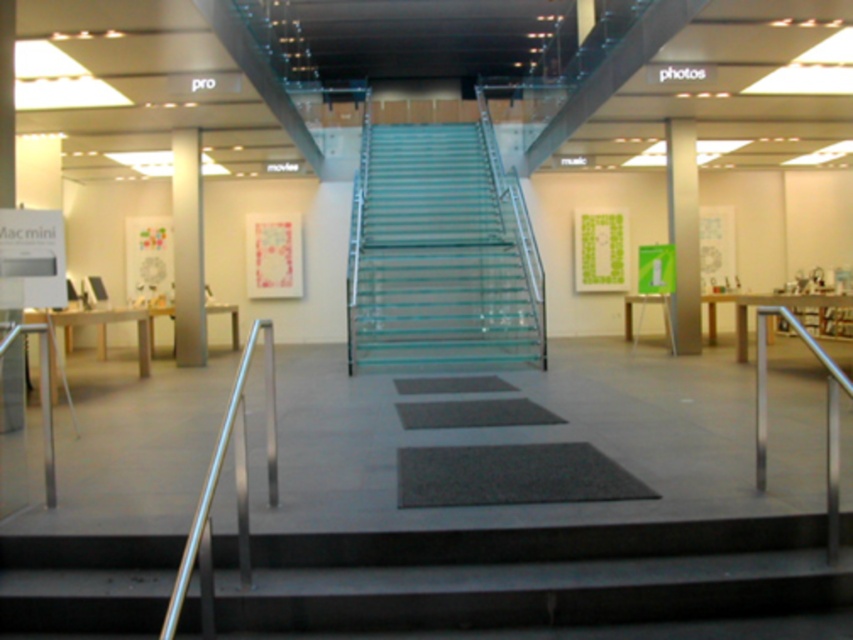
Question: Is black rubber mat at center positioned in front of silver metallic pillar at right?

Choices:
 (A) yes
 (B) no

Answer: (A)

Question: Among these objects, which one is farthest from the camera?

Choices:
 (A) black rubber mat at center
 (B) transparent glass stairs at center

Answer: (B)

Question: Which of the following is the closest to the observer?

Choices:
 (A) transparent glass stairs at center
 (B) metallic gray pillar at center

Answer: (B)

Question: Which object is farther from the camera taking this photo?

Choices:
 (A) silver metallic pillar at right
 (B) silver metallic handrail at right
 (C) black rubber mat at center
 (D) transparent glass stairs at center

Answer: (D)

Question: Does metallic gray stairs at center have a larger size compared to silver metallic pillar at right?

Choices:
 (A) yes
 (B) no

Answer: (B)

Question: Can you confirm if metallic gray pillar at center is positioned below silver metallic handrail at right?

Choices:
 (A) no
 (B) yes

Answer: (A)